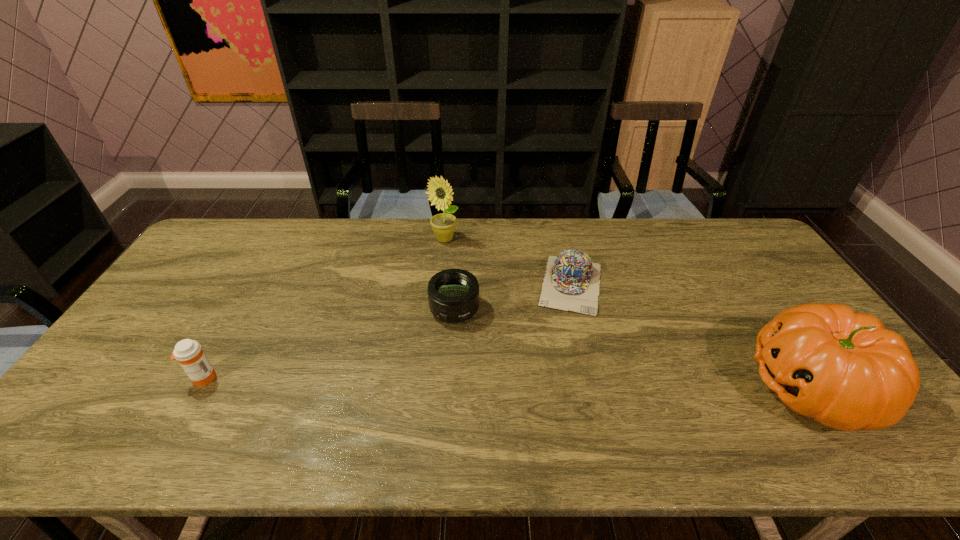
This screenshot has height=540, width=960. What are the coordinates of `free location located on the carved face of the rightmost object` in the screenshot? It's located at (622, 386).

This screenshot has width=960, height=540. I want to click on free space located 0.240m on the carved face of the rightmost object, so click(x=654, y=386).

In order to click on vacant space located on the front, side, and top of the fourth object from left to right in this screenshot , I will do `click(559, 389)`.

Identify the location of vacant space positioned 0.070m on the front, side, and top of the fourth object from left to right. (566, 333).

This screenshot has width=960, height=540. In order to click on vacant space situated 0.240m on the front, side, and top of the fourth object from left to right in this screenshot , I will do `click(560, 382)`.

Where is `vacant space located 0.280m on the side of the second shortest object with brand markings and control switches`? Image resolution: width=960 pixels, height=540 pixels. vacant space located 0.280m on the side of the second shortest object with brand markings and control switches is located at coordinates (422, 414).

Locate an element on the screen. This screenshot has height=540, width=960. vacant position located 0.210m on the side of the second shortest object with brand markings and control switches is located at coordinates (430, 390).

Identify the location of free space located 0.160m on the side of the second shortest object with brand markings and control switches. This screenshot has width=960, height=540. (435, 374).

In order to click on vacant region located on the face of the farthest object in this screenshot , I will do tap(444, 264).

At what (x,y) coordinates should I click in order to perform the action: click on vacant space positioned on the face of the farthest object. Please return your answer as a coordinate pair (x, y). Looking at the image, I should click on (444, 280).